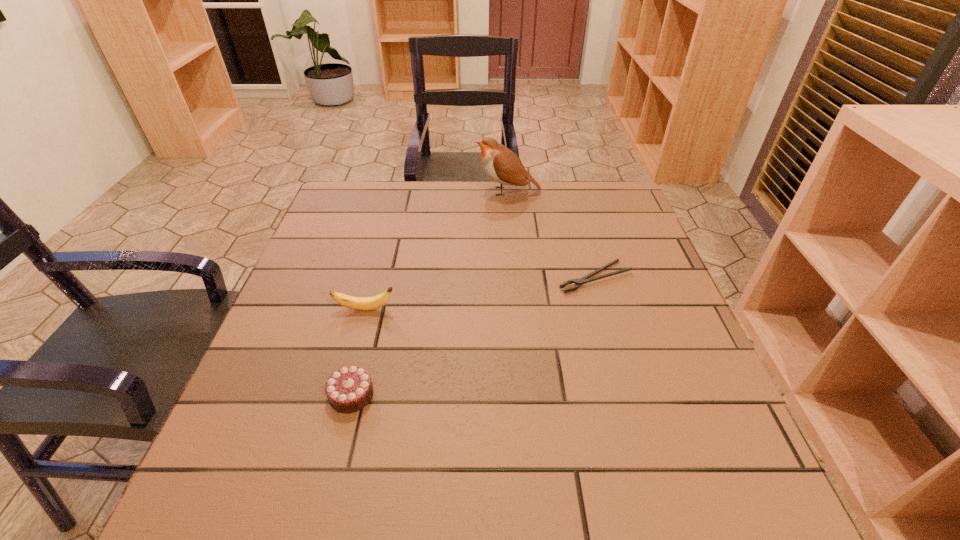
I want to click on vacant region located 0.150m at the face of the bird, so click(426, 191).

In order to click on vacant space located 0.400m at the stem of the banana in this screenshot , I will do `click(574, 309)`.

At what (x,y) coordinates should I click in order to perform the action: click on vacant space located 0.100m on the front of the third tallest object. Please return your answer as a coordinate pair (x, y). The height and width of the screenshot is (540, 960). Looking at the image, I should click on (333, 470).

Where is `free location located on the back of the shortest object`? The width and height of the screenshot is (960, 540). free location located on the back of the shortest object is located at coordinates (571, 194).

Identify the location of object located in the far edge section of the desktop. The image size is (960, 540). (502, 165).

This screenshot has height=540, width=960. I want to click on object that is at the left edge, so click(357, 303).

The width and height of the screenshot is (960, 540). I want to click on object that is at the right edge, so click(578, 282).

Locate an element on the screen. vacant area at the far edge is located at coordinates (527, 213).

Locate an element on the screen. The height and width of the screenshot is (540, 960). free space at the near edge is located at coordinates tap(389, 477).

The width and height of the screenshot is (960, 540). What are the coordinates of `vacant space at the left edge of the desktop` in the screenshot? It's located at (312, 269).